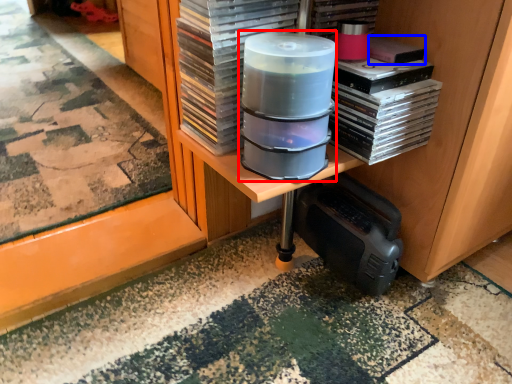
Question: Which object appears farthest to the camera in this image, appliance (highlighted by a red box) or paperback book (highlighted by a blue box)?

Choices:
 (A) appliance
 (B) paperback book

Answer: (B)